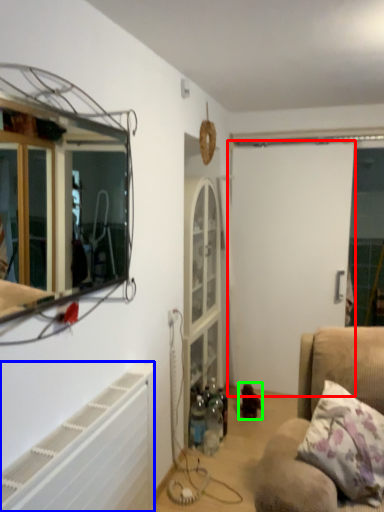
Question: Which object is the farthest from screen door (highlighted by a red box)? Choose among these: radiator (highlighted by a blue box) or toy (highlighted by a green box).

Choices:
 (A) radiator
 (B) toy

Answer: (A)